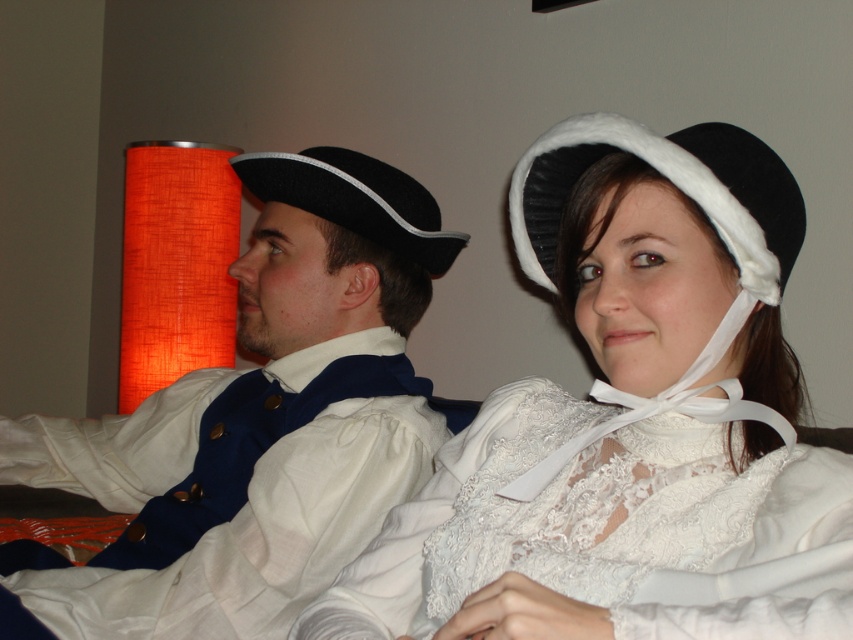
Based on the photo, you are an interior designer planning to place a decorative item between the matte black hat at upper left and the white lace blouse at center. Given that the decorative item needs to be smaller than both objects, which object should you use as the reference for the maximum size?

The decorative item must be smaller than both the matte black hat at upper left and the white lace blouse at center. Since the matte black hat at upper left is larger than the white lace blouse at center, the white lace blouse at center should be used as the reference for the maximum size to ensure the item fits appropriately between them.

You are a photographer setting up for a portrait. You need to ensure that the matte black hat at upper left and the white lace blouse at center are within a 20 inch focus range. Can you confirm if their distance apart allows this?

The matte black hat at upper left is 18.51 inches away from the white lace blouse at center, which is within the 20 inch focus range. Therefore, both objects can be captured in focus simultaneously.

You are an interior designer planning to place a decorative item at the point marked as point (672,182). What object currently occupies this location?

The point (672,182) is occupied by the black velvet bonnet at upper right.